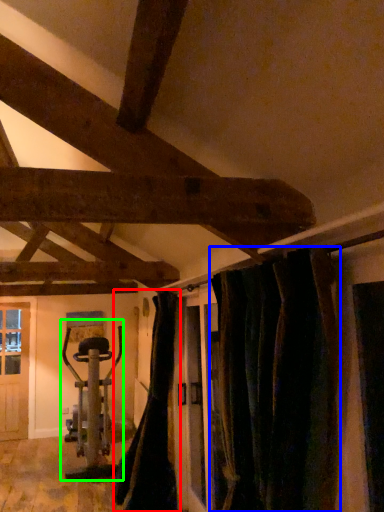
Question: Based on their relative distances, which object is farther from curtain (highlighted by a red box)? Choose from curtain (highlighted by a blue box) and sport equipment (highlighted by a green box).

Choices:
 (A) curtain
 (B) sport equipment

Answer: (A)